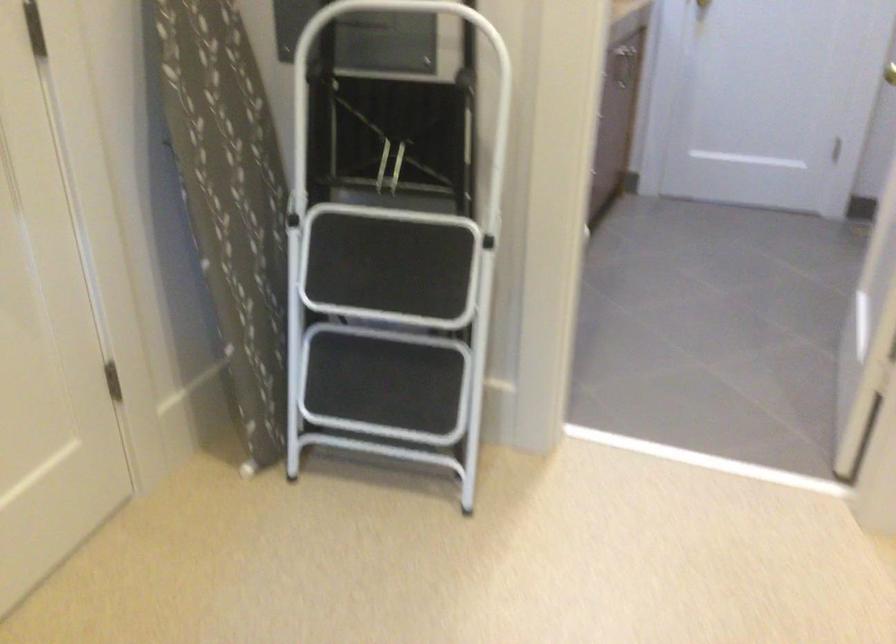
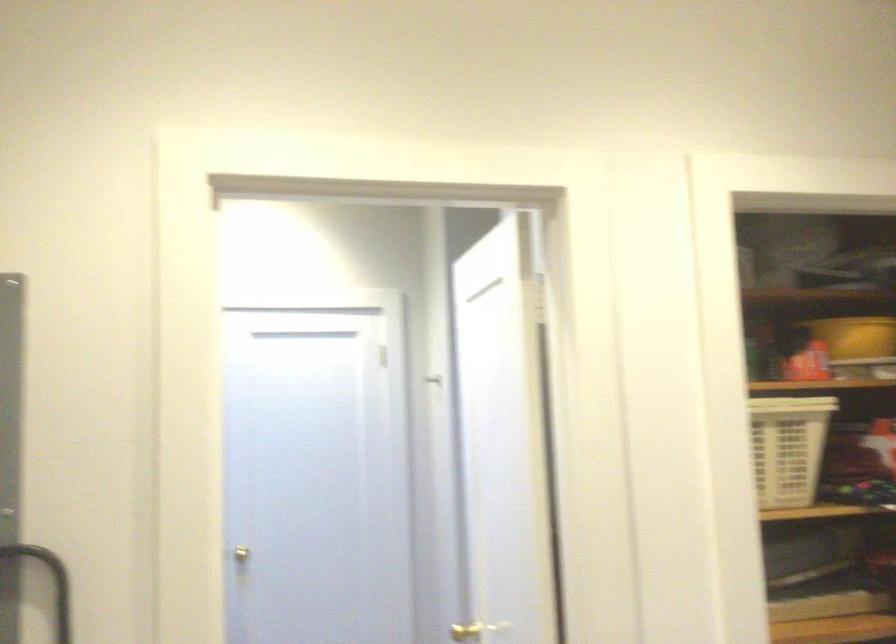
The images are taken continuously from a first-person perspective. In which direction is your viewpoint rotating?

The camera's rotation is toward right-up.